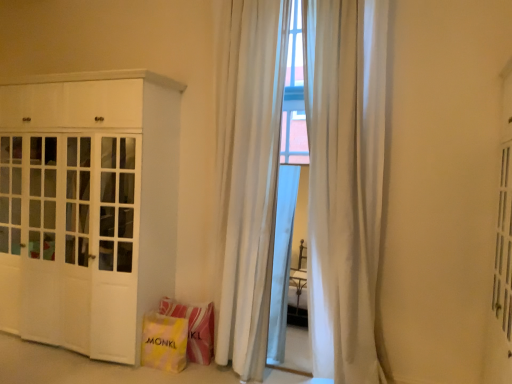
Question: Is yellow fabric shopping bag at lower center, the 1th shopping bag from the back, to the left or to the right of yellow fabric shopping bag at lower left, placed as the 1th shopping bag when sorted from front to back, in the image?

Choices:
 (A) right
 (B) left

Answer: (A)

Question: Is yellow fabric shopping bag at lower center, the 1th shopping bag from the back, taller or shorter than yellow fabric shopping bag at lower left, placed as the 1th shopping bag when sorted from front to back?

Choices:
 (A) short
 (B) tall

Answer: (B)

Question: Which of these objects is positioned closest to the yellow fabric shopping bag at lower left, positioned as the 2th shopping bag in back-to-front order?

Choices:
 (A) white matte cabinet at left
 (B) white sheer curtain at center, placed as the second curtain when sorted from right to left
 (C) yellow fabric shopping bag at lower center, which appears as the second shopping bag when viewed from the front
 (D) white sheer curtain at center, the 2th curtain positioned from the left

Answer: (C)

Question: Estimate the real-world distances between objects in this image. Which object is farther from the yellow fabric shopping bag at lower left, positioned as the 2th shopping bag in back-to-front order?

Choices:
 (A) white sheer curtain at center, placed as the second curtain when sorted from right to left
 (B) yellow fabric shopping bag at lower center, the 1th shopping bag from the back
 (C) white sheer curtain at center, the 2th curtain positioned from the left
 (D) white matte cabinet at left

Answer: (C)